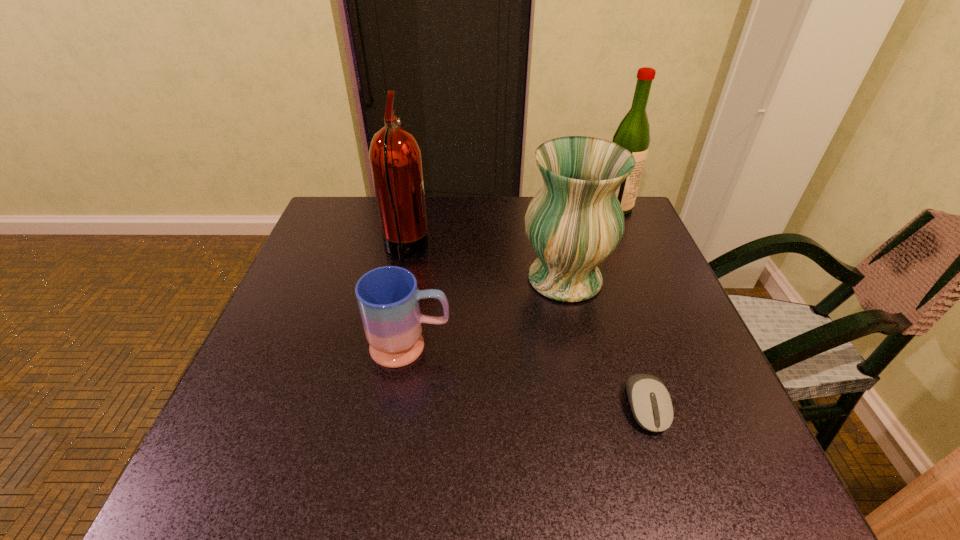
Locate an element on the screen. This screenshot has height=540, width=960. vacant region between the nearest object and the fire extinguisher is located at coordinates (526, 328).

This screenshot has width=960, height=540. What are the coordinates of `free spot between the nearest object and the second shortest object` in the screenshot? It's located at (528, 376).

The height and width of the screenshot is (540, 960). I want to click on free space between the fourth tallest object and the third shortest object, so click(x=488, y=313).

What are the coordinates of `vacant space that's between the farthest object and the computer equipment` in the screenshot? It's located at (631, 307).

Identify which object is the fourth nearest to the vase. Please provide its 2D coordinates. Your answer should be formatted as a tuple, i.e. [(x, y)], where the tuple contains the x and y coordinates of a point satisfying the conditions above.

[(395, 157)]

This screenshot has height=540, width=960. In order to click on the closest object relative to the fire extinguisher in this screenshot , I will do `click(388, 297)`.

This screenshot has width=960, height=540. I want to click on vacant space that satisfies the following two spatial constraints: 1. on the label of the rightmost object; 2. on the wheel side of the shortest object, so click(702, 407).